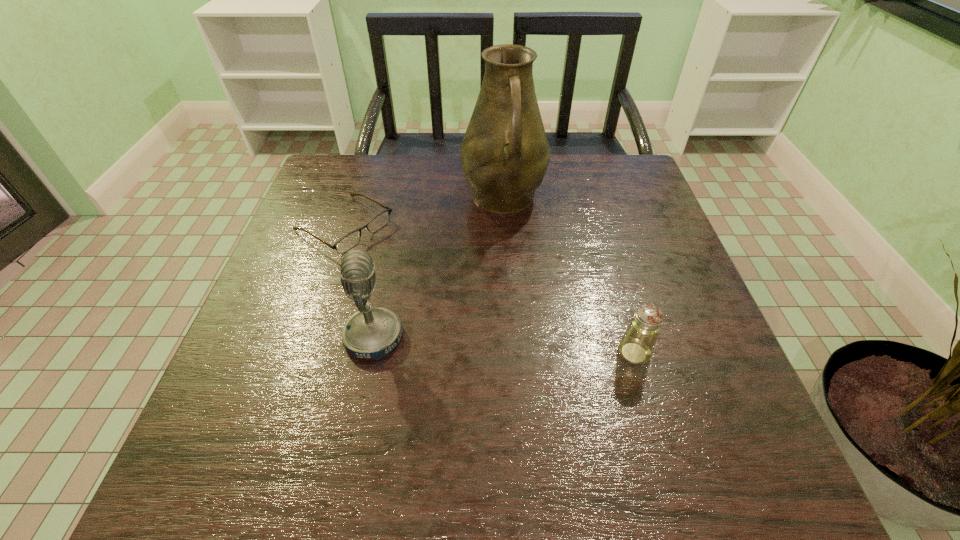
The height and width of the screenshot is (540, 960). What are the coordinates of `vacant space located on the handle side of the tallest object` in the screenshot? It's located at (536, 349).

Identify the location of vacant area located on the front-facing side of the shortest object. This screenshot has width=960, height=540. (452, 293).

This screenshot has width=960, height=540. I want to click on vacant region located on the front-facing side of the shortest object, so click(x=410, y=266).

At what (x,y) coordinates should I click in order to perform the action: click on free space located on the front-facing side of the shortest object. Please return your answer as a coordinate pair (x, y). The width and height of the screenshot is (960, 540). Looking at the image, I should click on (456, 295).

Locate an element on the screen. The image size is (960, 540). pitcher located in the far edge section of the desktop is located at coordinates (505, 153).

You are a GUI agent. You are given a task and a screenshot of the screen. Output one action in this format:
    pyautogui.click(x=<x>, y=<y>)
    Task: Click on the spectacles that is at the far edge
    This screenshot has height=540, width=960.
    Given the screenshot: What is the action you would take?
    pos(347,242)

Where is `object positioned at the left edge`? object positioned at the left edge is located at coordinates (347, 242).

Image resolution: width=960 pixels, height=540 pixels. In order to click on object at the right edge in this screenshot , I will do `click(636, 346)`.

This screenshot has width=960, height=540. Identify the location of object located at the far left corner. (347, 242).

Locate an element on the screen. vacant space at the far edge of the desktop is located at coordinates (408, 183).